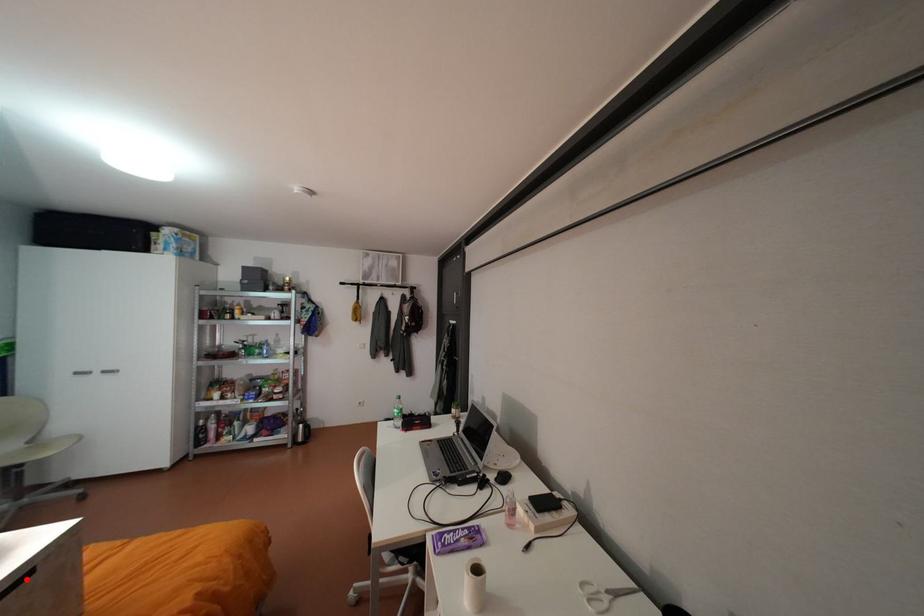
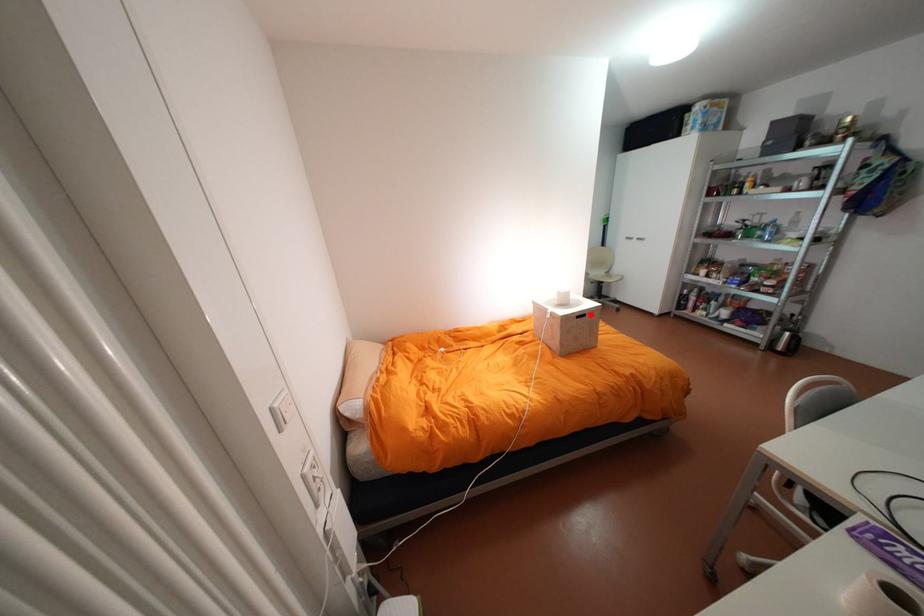
I am providing you with two images of the same scene from different viewpoints. A red point is marked on the first image and another point is marked on the second image. Is the marked point in image1 the same physical position as the marked point in image2?

Yes